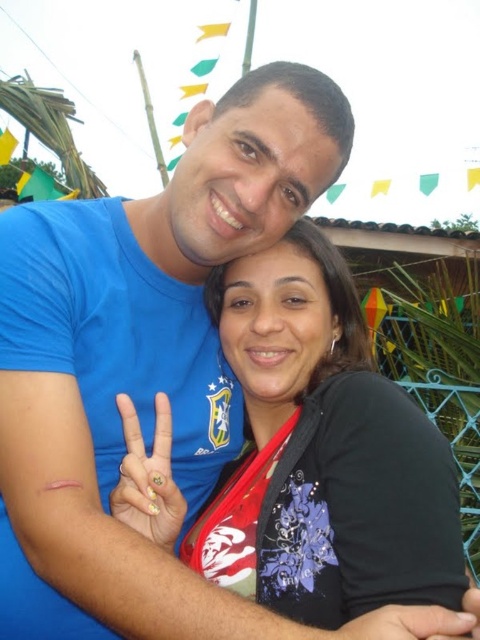
Question: Which object appears closest to the camera in this image?

Choices:
 (A) smooth skin hand at center
 (B) matte black shirt at center

Answer: (A)

Question: Can you confirm if gold glitter nail polish at center is smaller than smooth skin hand at center?

Choices:
 (A) yes
 (B) no

Answer: (B)

Question: Is the position of matte black shirt at center less distant than that of smooth skin hand at center?

Choices:
 (A) no
 (B) yes

Answer: (A)

Question: Which point is farther from the camera taking this photo?

Choices:
 (A) (379, 634)
 (B) (173, 547)

Answer: (B)

Question: From the image, what is the correct spatial relationship of matte black shirt at center in relation to smooth skin hand at center?

Choices:
 (A) below
 (B) above

Answer: (B)

Question: Which is nearer to the matte black shirt at center?

Choices:
 (A) gold glitter nail polish at center
 (B) smooth skin hand at center

Answer: (A)